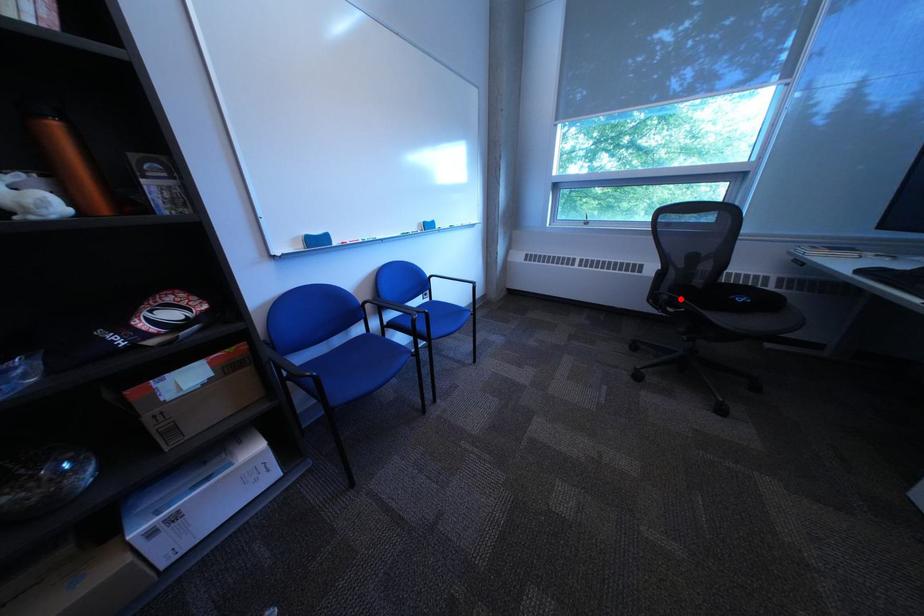
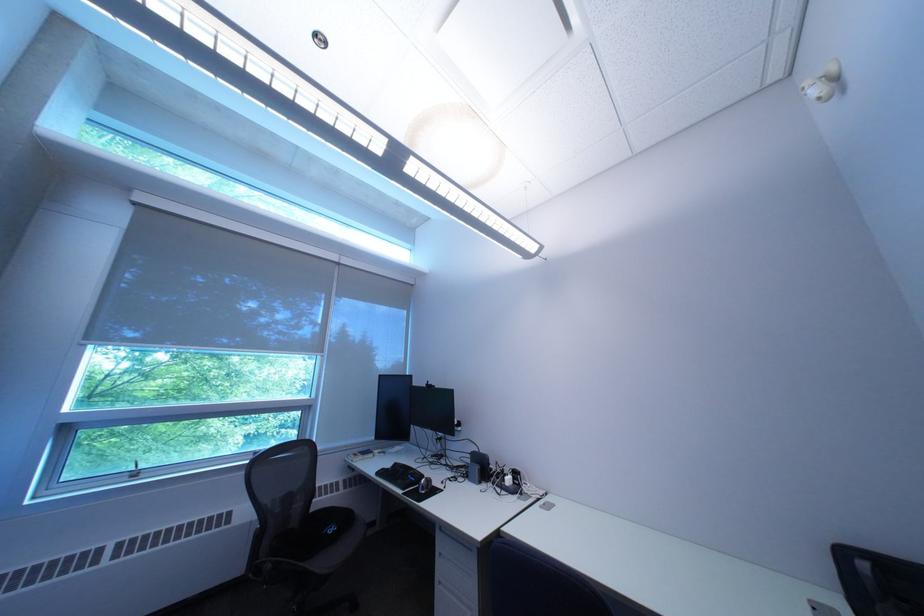
Question: I am providing you with two images of the same scene from different viewpoints. Given a red point in image1, look at the same physical point in image2. Is it:

Choices:
 (A) Closer to the viewpoint
 (B) Farther from the viewpoint

Answer: (B)